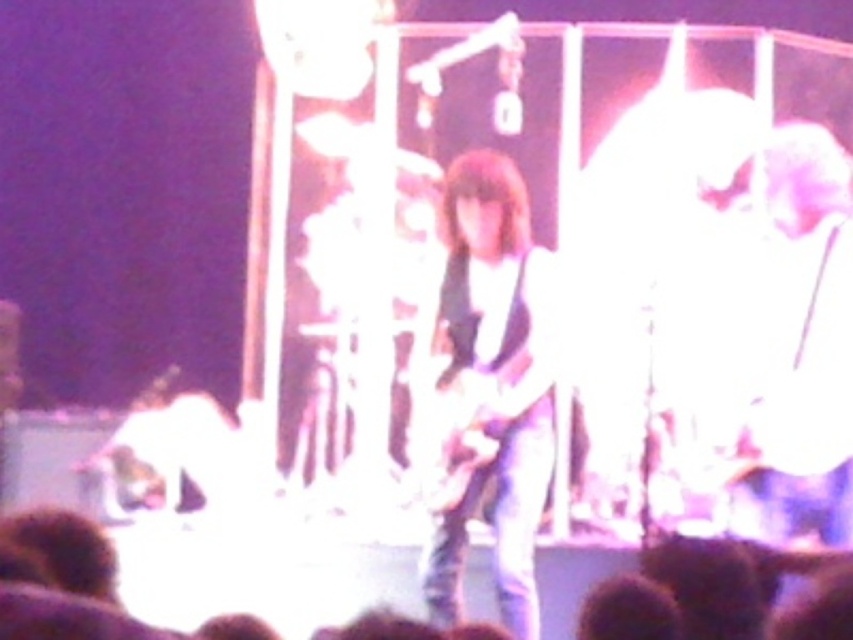
Who is shorter, matte black guitar at center or shiny metallic guitar at center?

Standing shorter between the two is shiny metallic guitar at center.

Is matte black guitar at center above shiny metallic guitar at center?

Yes.

Identify the location of matte black guitar at center. This screenshot has height=640, width=853. (488, 388).

You are a GUI agent. You are given a task and a screenshot of the screen. Output one action in this format:
    pyautogui.click(x=<x>, y=<y>)
    Task: Click on the matte black guitar at center
    
    Given the screenshot: What is the action you would take?
    tap(488, 388)